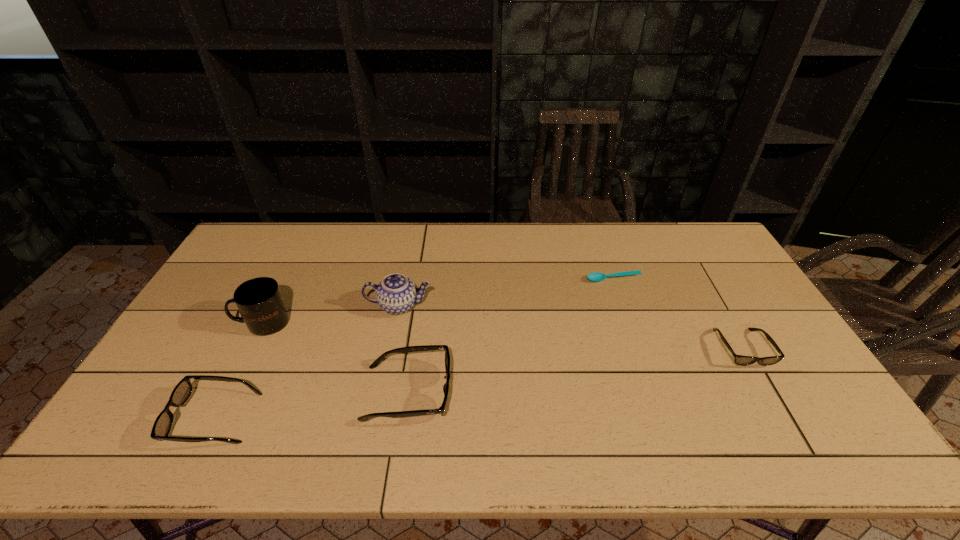
If equal spacing is the goal by inserting an additional spectacles among them, please point out a vacant space for this new spectacles. Please provide its 2D coordinates. Your answer should be formatted as a tuple, i.e. [(x, y)], where the tuple contains the x and y coordinates of a point satisfying the conditions above.

[(583, 369)]